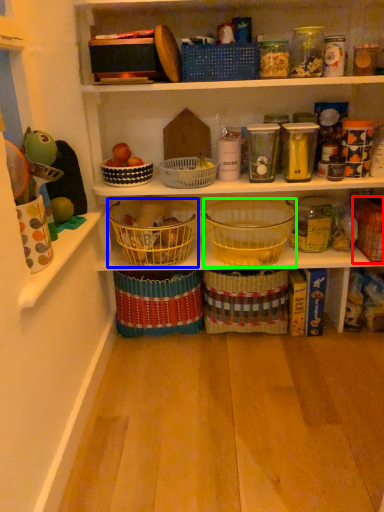
Question: Which object is the farthest from basket (highlighted by a red box)? Choose among these: basket (highlighted by a blue box) or basket (highlighted by a green box).

Choices:
 (A) basket
 (B) basket

Answer: (A)